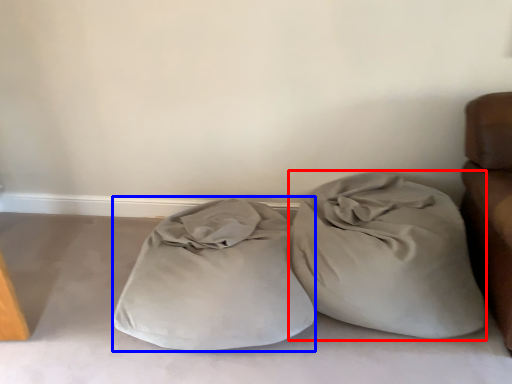
Question: Which point is further to the camera, throw pillow (highlighted by a red box) or pillow (highlighted by a blue box)?

Choices:
 (A) throw pillow
 (B) pillow

Answer: (A)